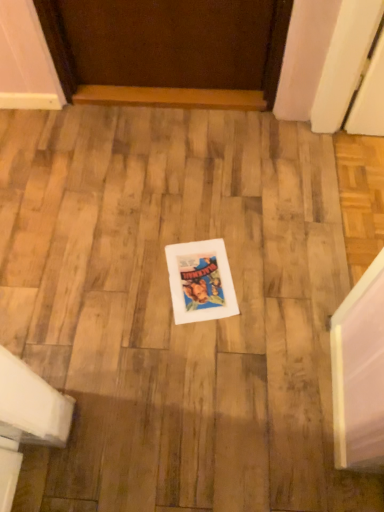
Locate an element on the screen. The image size is (384, 512). free spot in front of matte paper comic book at center is located at coordinates (207, 350).